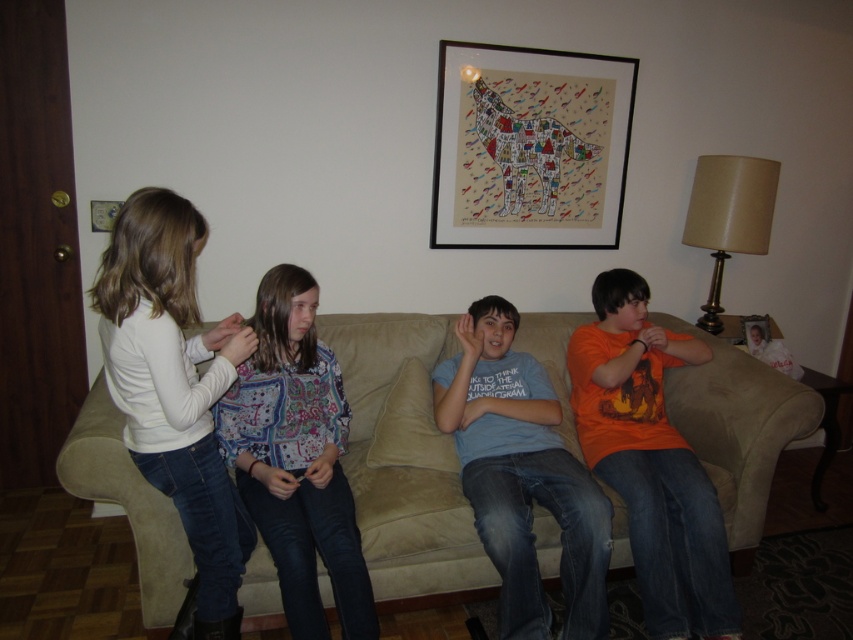
Question: Does patterned fabric shirt at center lie behind blue cotton shirt at center?

Choices:
 (A) yes
 (B) no

Answer: (B)

Question: Does suede couch at center appear under wooden framed artwork at upper center?

Choices:
 (A) no
 (B) yes

Answer: (B)

Question: Does suede couch at center appear over blue cotton shirt at center?

Choices:
 (A) no
 (B) yes

Answer: (B)

Question: Which point is farther to the camera?

Choices:
 (A) patterned fabric shirt at center
 (B) orange cotton shirt at right

Answer: (B)

Question: Which object appears farthest from the camera in this image?

Choices:
 (A) blue cotton shirt at center
 (B) patterned fabric shirt at center

Answer: (A)

Question: Among these objects, which one is nearest to the camera?

Choices:
 (A) blue cotton shirt at center
 (B) wooden framed artwork at upper center

Answer: (A)